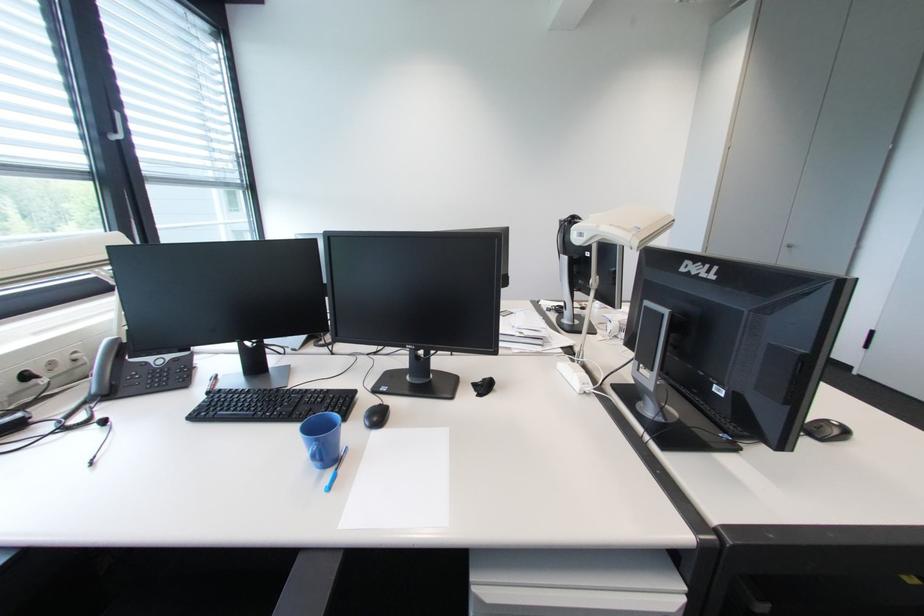
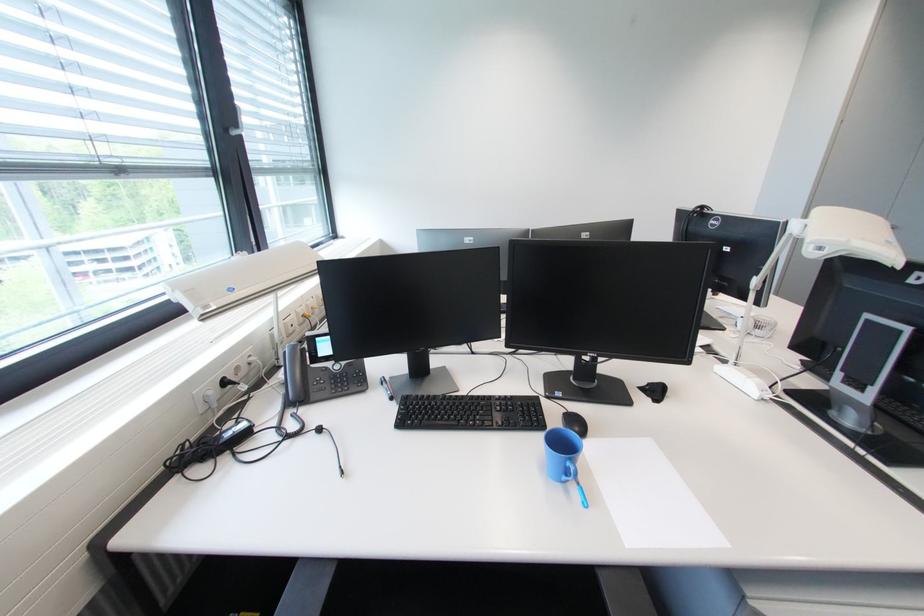
Locate, in the second image, the point that corresponds to the point at 120,342 in the first image.

(300, 349)